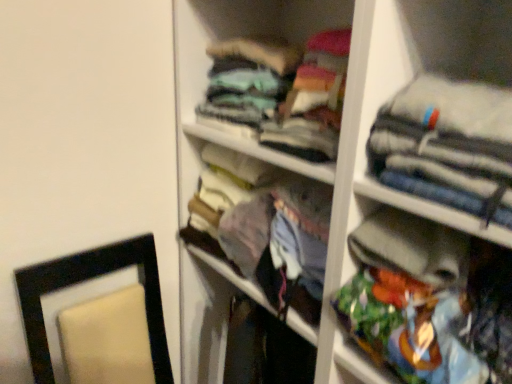
Question: Should I look upward or downward to see gray fabric jacket at upper right, the second clothing positioned from the bottom?

Choices:
 (A) up
 (B) down

Answer: (A)

Question: Does multicolored fabric bag at right, which is the first clothing from bottom to top, have a greater width compared to teal fabric shirt at upper center, which is the third clothing from bottom to top?

Choices:
 (A) yes
 (B) no

Answer: (B)

Question: Considering the relative positions of multicolored fabric bag at right, which is the 3th clothing from top to bottom, and teal fabric shirt at upper center, which is the third clothing from bottom to top, in the image provided, is multicolored fabric bag at right, which is the 3th clothing from top to bottom, behind teal fabric shirt at upper center, which is the third clothing from bottom to top,?

Choices:
 (A) no
 (B) yes

Answer: (A)

Question: Is multicolored fabric bag at right, which is the 3th clothing from top to bottom, taller than teal fabric shirt at upper center, the first clothing from the top?

Choices:
 (A) yes
 (B) no

Answer: (A)

Question: Is multicolored fabric bag at right, which is the 3th clothing from top to bottom, oriented towards teal fabric shirt at upper center, the first clothing from the top?

Choices:
 (A) yes
 (B) no

Answer: (B)

Question: Is multicolored fabric bag at right, which is the 3th clothing from top to bottom, smaller than teal fabric shirt at upper center, the first clothing from the top?

Choices:
 (A) yes
 (B) no

Answer: (A)

Question: Is multicolored fabric bag at right, which is the 3th clothing from top to bottom, bigger than teal fabric shirt at upper center, which is the third clothing from bottom to top?

Choices:
 (A) no
 (B) yes

Answer: (A)

Question: Considering the relative sizes of teal fabric shirt at upper center, the first clothing from the top, and gray fabric jacket at upper right, which is the 2th clothing from top to bottom, in the image provided, is teal fabric shirt at upper center, the first clothing from the top, shorter than gray fabric jacket at upper right, which is the 2th clothing from top to bottom,?

Choices:
 (A) no
 (B) yes

Answer: (A)

Question: Could you tell me if teal fabric shirt at upper center, the first clothing from the top, is turned towards gray fabric jacket at upper right, the second clothing positioned from the bottom?

Choices:
 (A) yes
 (B) no

Answer: (B)

Question: From a real-world perspective, is teal fabric shirt at upper center, which is the third clothing from bottom to top, positioned under gray fabric jacket at upper right, the second clothing positioned from the bottom, based on gravity?

Choices:
 (A) no
 (B) yes

Answer: (B)

Question: Is teal fabric shirt at upper center, the first clothing from the top, positioned beyond the bounds of gray fabric jacket at upper right, the second clothing positioned from the bottom?

Choices:
 (A) yes
 (B) no

Answer: (A)

Question: From the image's perspective, is teal fabric shirt at upper center, which is the third clothing from bottom to top, located above gray fabric jacket at upper right, which is the 2th clothing from top to bottom?

Choices:
 (A) yes
 (B) no

Answer: (A)

Question: Considering the relative sizes of teal fabric shirt at upper center, the first clothing from the top, and gray fabric jacket at upper right, which is the 2th clothing from top to bottom, in the image provided, is teal fabric shirt at upper center, the first clothing from the top, taller than gray fabric jacket at upper right, which is the 2th clothing from top to bottom,?

Choices:
 (A) no
 (B) yes

Answer: (B)

Question: Can you confirm if gray fabric jacket at upper right, which is the 2th clothing from top to bottom, is positioned to the right of multicolored fabric bag at right, which is the first clothing from bottom to top?

Choices:
 (A) no
 (B) yes

Answer: (A)